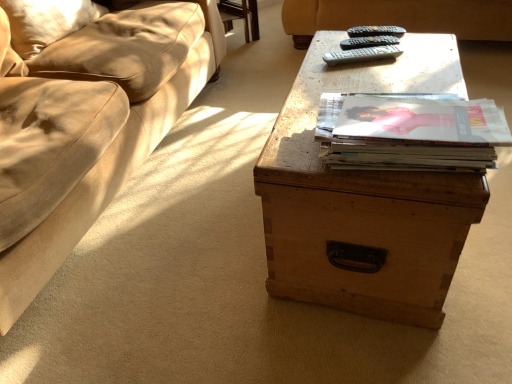
Question: Is gray plastic remote at upper center, which ranks as the 3th remote in top-to-bottom order, inside the boundaries of suede-like beige pillow at upper left, or outside?

Choices:
 (A) outside
 (B) inside

Answer: (A)

Question: In terms of height, does gray plastic remote at upper center, which ranks as the 3th remote in top-to-bottom order, look taller or shorter compared to suede-like beige pillow at upper left?

Choices:
 (A) short
 (B) tall

Answer: (A)

Question: Which of these objects is positioned closest to the black plastic remote at upper center, arranged as the 2th remote when viewed from the top?

Choices:
 (A) gray plastic remote at upper center, which ranks as the first remote in bottom-to-top order
 (B) suede-like beige pillow at upper left
 (C) matte paper stack of magazines at center
 (D) black plastic remote at upper center, the third remote positioned from the bottom
 (E) wooden trunk at center

Answer: (D)

Question: Which object is positioned farthest from the black plastic remote at upper center, the second remote when ordered from bottom to top?

Choices:
 (A) black plastic remote at upper center, the third remote positioned from the bottom
 (B) wooden trunk at center
 (C) matte paper stack of magazines at center
 (D) gray plastic remote at upper center, which ranks as the first remote in bottom-to-top order
 (E) suede-like beige pillow at upper left

Answer: (E)